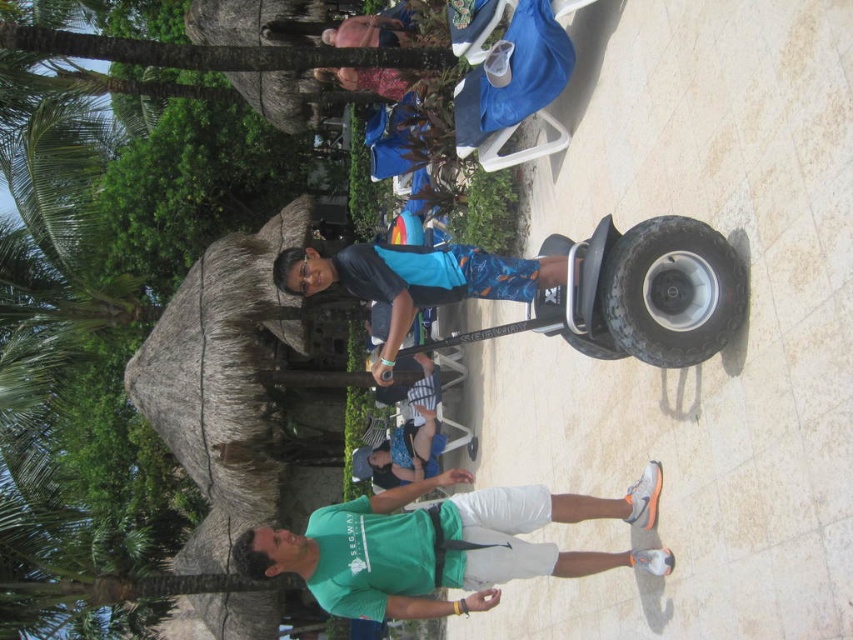
You are a tour guide at the resort and need to ensure safety distances between guests and equipment. According to the resort guidelines, guests must maintain a minimum distance of 30 meters from any moving equipment. Are the black rubber tire at center and denim shorts at lower center adhering to this safety regulation?

The black rubber tire at center and denim shorts at lower center are 28.75 meters apart from each other, which is less than the required 30 meters. Therefore, they are not adhering to the safety regulation.

You are a photographer trying to capture a clear shot of the green fabric shirt at lower center and the black rubber tire at center. If you want to ensure both are fully visible in the frame, which object should you prioritize keeping closer to the camera?

The green fabric shirt at lower center might be wider than black rubber tire at center, so you should prioritize keeping the green fabric shirt at lower center closer to the camera to ensure it fits within the frame.

Based on the photo, you are a photographer positioned at the scene. You want to capture a photo that includes both the green fabric shirt at lower center and the denim shorts at lower center. Considering their distance apart, will you need to zoom in or zoom out to ensure both are in the frame?

The green fabric shirt at lower center is 22.55 meters from the denim shorts at lower center. To include both in the frame, you would need to zoom out to accommodate the distance between them.